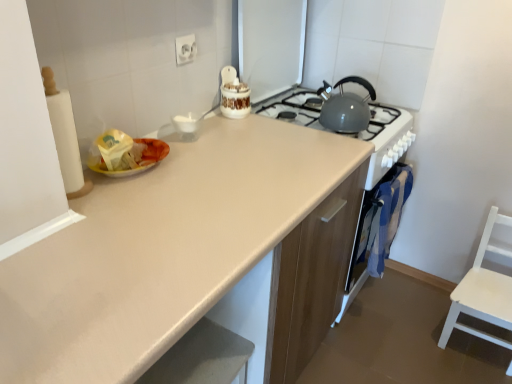
Question: In terms of width, does matte beige countertop at center look wider or thinner when compared to white wood chair at right?

Choices:
 (A) thin
 (B) wide

Answer: (B)

Question: Relative to white wood chair at right, is matte beige countertop at center in front or behind?

Choices:
 (A) front
 (B) behind

Answer: (A)

Question: Based on their relative distances, which object is nearer to the white plastic electric outlet at upper center?

Choices:
 (A) blue fabric oven at right
 (B) matte gray kettle at upper right
 (C) matte beige countertop at center
 (D) white wood chair at right

Answer: (B)

Question: Estimate the real-world distances between objects in this image. Which object is closer to the matte beige countertop at center?

Choices:
 (A) matte gray kettle at upper right
 (B) white wood chair at right
 (C) white plastic electric outlet at upper center
 (D) blue fabric oven at right

Answer: (D)